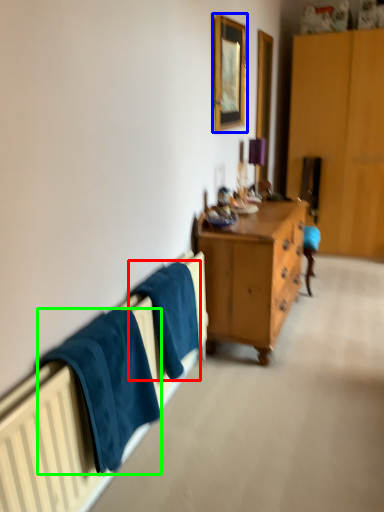
Question: Considering the real-world distances, which object is closest to bath towel (highlighted by a red box)? picture frame (highlighted by a blue box) or towel/napkin (highlighted by a green box).

Choices:
 (A) picture frame
 (B) towel/napkin

Answer: (B)